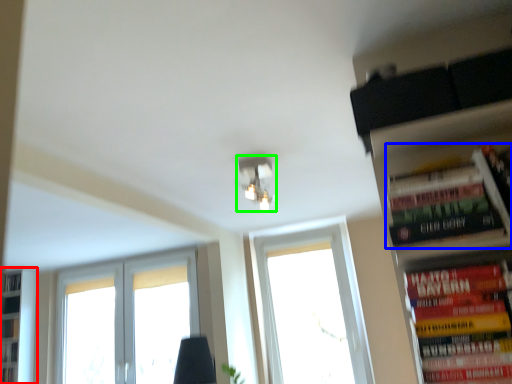
Question: Estimate the real-world distances between objects in this image. Which object is farther from bookshelf (highlighted by a red box), book (highlighted by a blue box) or light fixture (highlighted by a green box)?

Choices:
 (A) book
 (B) light fixture

Answer: (A)